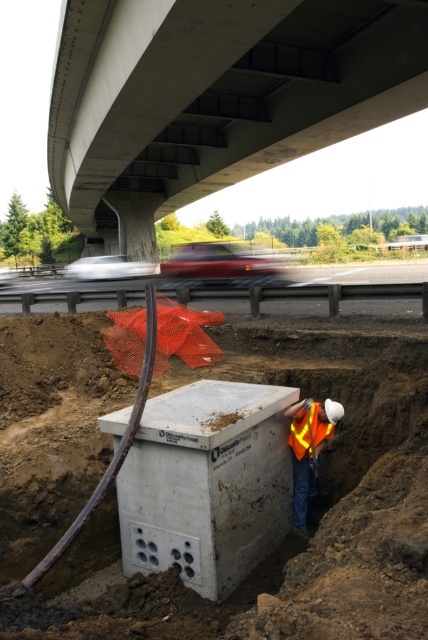
In the scene shown: Is concrete at upper center below concrete barrier at lower center?

Actually, concrete at upper center is above concrete barrier at lower center.

Does point (296, 125) lie behind point (278, 292)?

Yes, point (296, 125) is behind point (278, 292).

At what (x,y) coordinates should I click in order to perform the action: click on concrete at upper center. Please return your answer as a coordinate pair (x, y). Looking at the image, I should click on (214, 97).

Can you confirm if concrete barrier at lower center is bigger than reflective orange vest at center?

Correct, concrete barrier at lower center is larger in size than reflective orange vest at center.

Who is shorter, concrete barrier at lower center or reflective orange vest at center?

With less height is reflective orange vest at center.

What do you see at coordinates (326, 288) in the screenshot? Image resolution: width=428 pixels, height=640 pixels. I see `concrete barrier at lower center` at bounding box center [326, 288].

Find the location of a particular element. Image resolution: width=428 pixels, height=640 pixels. concrete barrier at lower center is located at coordinates (326, 288).

In the scene shown: Does reflective orange vest at center have a greater height compared to reflective fabric safety vest at center?

Indeed, reflective orange vest at center has a greater height compared to reflective fabric safety vest at center.

Describe the element at coordinates (309, 452) in the screenshot. I see `reflective orange vest at center` at that location.

Identify the location of reflective orange vest at center. The height and width of the screenshot is (640, 428). (309, 452).

This screenshot has width=428, height=640. Identify the location of reflective orange vest at center. (309, 452).